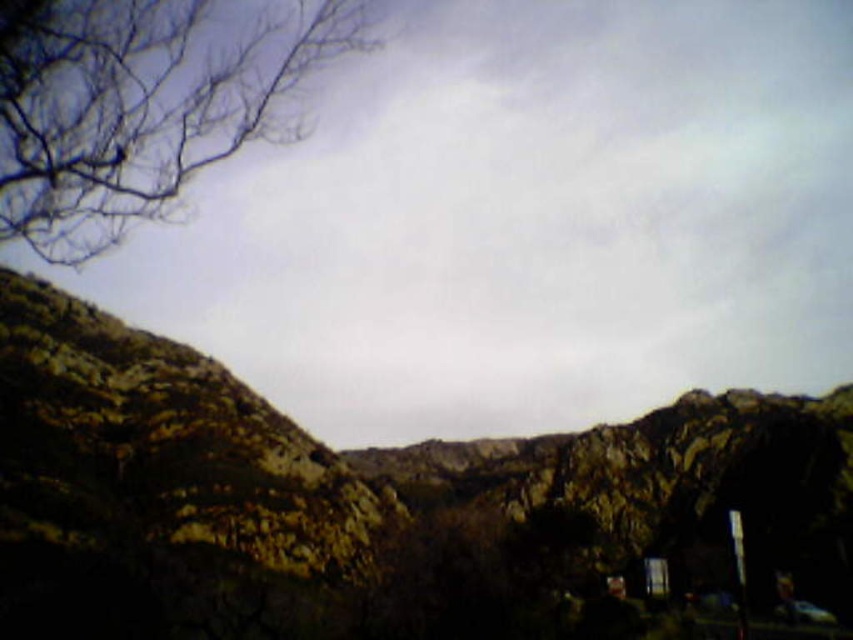
You are a hiker navigating a rugged mountain trail. You see a point marked at coordinates (x=378, y=506). What does this point indicate?

The point at (x=378, y=506) marks the rugged stone mountain at center, so it indicates the location of the rugged stone mountain at center.

You are a hiker trying to navigate through the rugged stone mountain at center and the brown rough rock at center. Which path would be more challenging to climb?

The rugged stone mountain at center is larger in size than the brown rough rock at center, so climbing the rugged stone mountain at center would be more challenging due to its greater size and possibly steeper terrain.